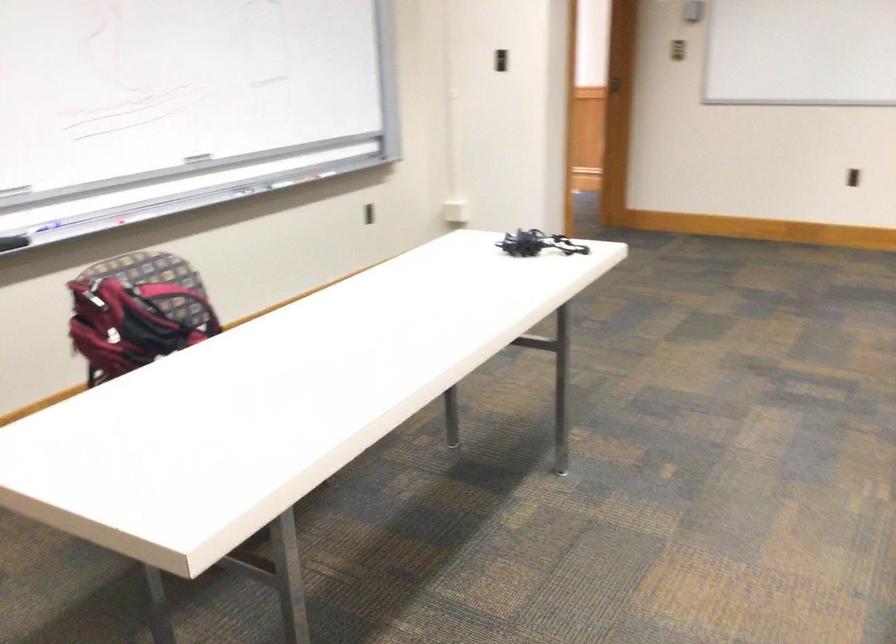
Where would you eras the black whiteboard eraser? Please return your answer as a coordinate pair (x, y).

(193, 164)